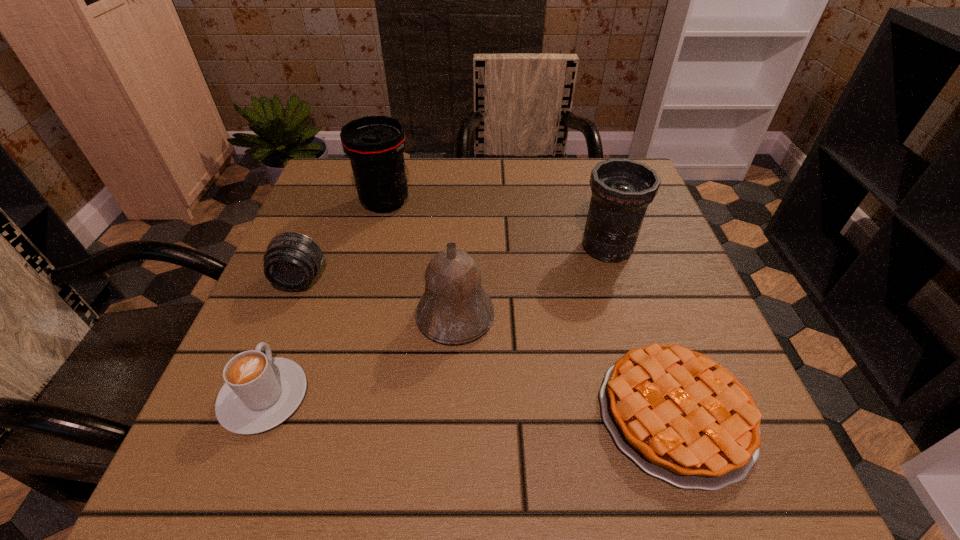
I want to click on the farthest telephoto lens, so click(375, 144).

The width and height of the screenshot is (960, 540). Identify the location of the farthest object. (375, 144).

Where is `the rightmost telephoto lens`? The height and width of the screenshot is (540, 960). the rightmost telephoto lens is located at coordinates (622, 189).

Find the location of a particular element. This screenshot has height=540, width=960. the third object from right to left is located at coordinates (454, 309).

Locate an element on the screen. This screenshot has width=960, height=540. the fourth tallest object is located at coordinates (292, 260).

Identify the location of the leftmost telephoto lens. Image resolution: width=960 pixels, height=540 pixels. (292, 260).

This screenshot has width=960, height=540. In order to click on cappuccino in this screenshot , I will do `click(260, 392)`.

In order to click on the shortest object in this screenshot , I will do `click(681, 417)`.

Where is `free spot located 0.350m on the right of the farthest object`? The image size is (960, 540). free spot located 0.350m on the right of the farthest object is located at coordinates (560, 202).

You are a GUI agent. You are given a task and a screenshot of the screen. Output one action in this format:
    pyautogui.click(x=<x>, y=<y>)
    Task: Click on the free space located 0.350m on the left of the rightmost telephoto lens
    This screenshot has height=540, width=960.
    Given the screenshot: What is the action you would take?
    pyautogui.click(x=414, y=247)